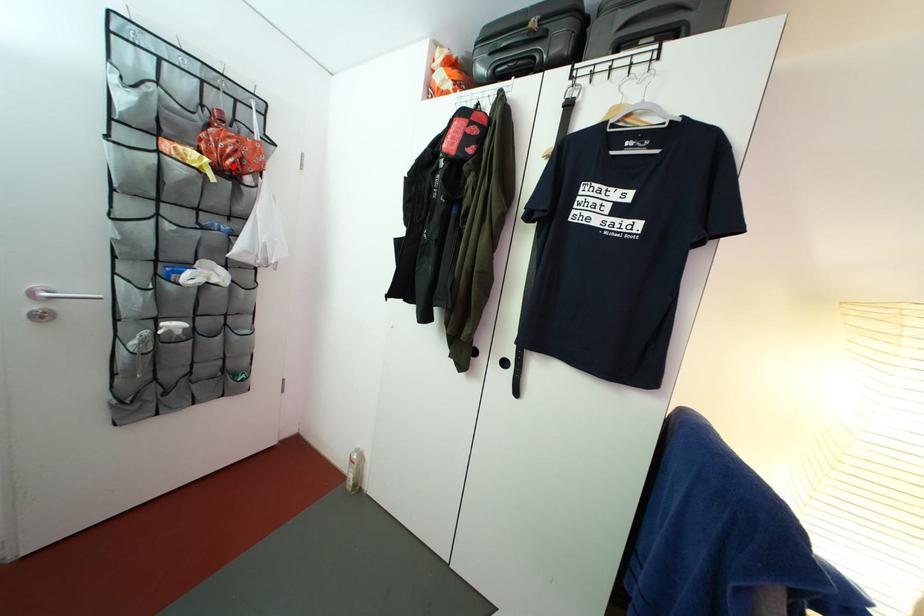
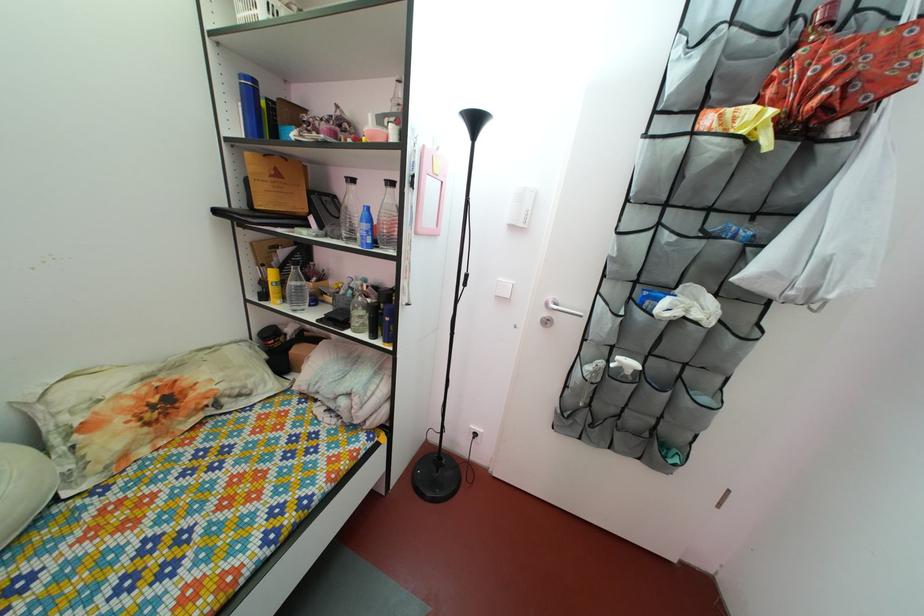
In the second image, find the point that corresponds to the highlighted location in the first image.

(816, 103)